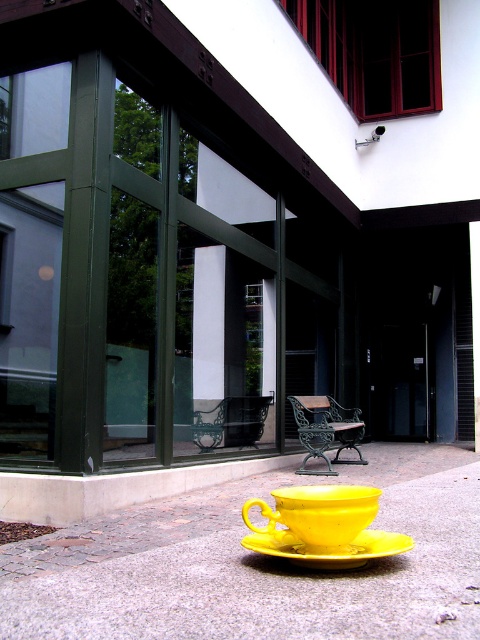
Question: Is yellow ceramic cup at lower center positioned before yellow matte/satin saucer at lower center?

Choices:
 (A) no
 (B) yes

Answer: (A)

Question: Which of the following is the closest to the observer?

Choices:
 (A) yellow ceramic cup at lower center
 (B) yellow ceramic cup at center
 (C) yellow matte teacup at lower center

Answer: (C)

Question: From the image, what is the correct spatial relationship of yellow ceramic cup at center in relation to yellow matte/satin saucer at lower center?

Choices:
 (A) left
 (B) right

Answer: (A)

Question: Which of the following is the closest to the observer?

Choices:
 (A) (287, 627)
 (B) (254, 541)

Answer: (A)

Question: Does yellow ceramic cup at center have a lesser width compared to yellow matte teacup at lower center?

Choices:
 (A) no
 (B) yes

Answer: (A)

Question: Among these objects, which one is farthest from the camera?

Choices:
 (A) yellow matte teacup at lower center
 (B) yellow ceramic cup at lower center
 (C) yellow matte/satin saucer at lower center
 (D) yellow ceramic cup at center

Answer: (B)